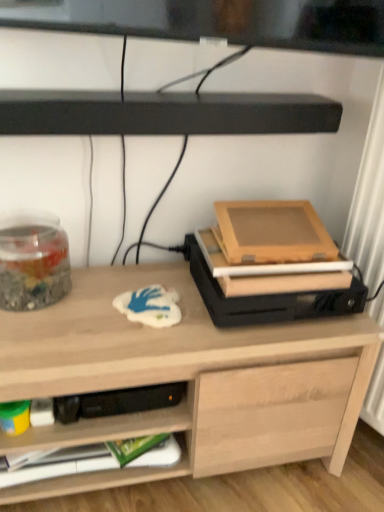
Identify the location of vacant area that is situated to the right of transparent glass jar at left. (98, 291).